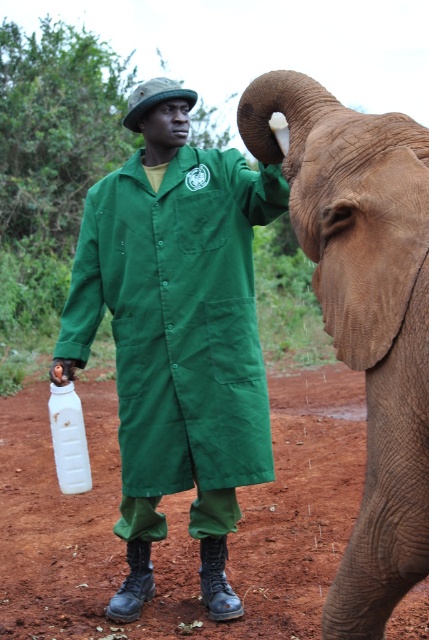
You are a wildlife photographer trying to capture a close interaction between the green fabric uniform at center and the brown textured skin at right. Given that your camera has a minimum focus distance of 3 feet, will you be able to take the photo without moving either object?

The green fabric uniform at center and brown textured skin at right are 3.54 feet apart from each other. Since the distance between them is greater than the camera minimum focus distance of 3 feet, you can take the photo without moving either object.

You are a park ranger assessing the safety of an interaction between a person and an elephant. The person is wearing a green fabric uniform at center and the elephant has brown textured skin at right. Based on the size comparison between these two, is the elephant at risk of being overcrowded by the person?

The green fabric uniform at center is bigger than brown textured skin at right, which means the person is larger than the elephant. This could pose a safety risk as the person might be too close or overwhelming the elephant, so maintaining a safe distance is advisable.